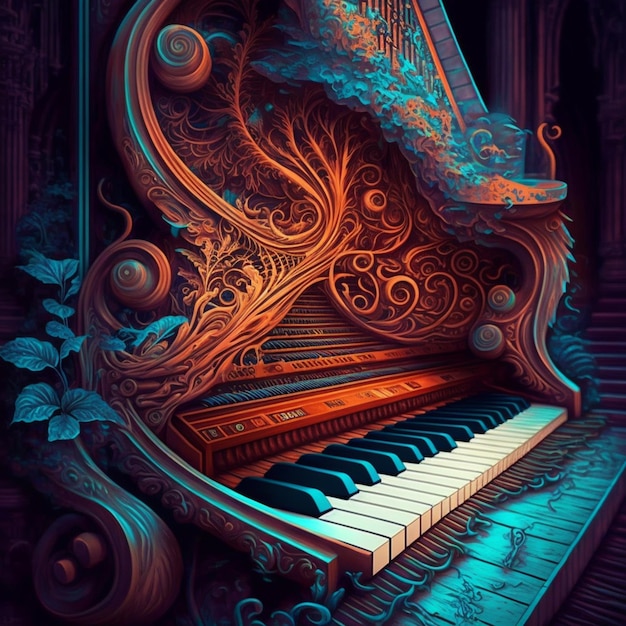
Find the location of `curved wood in the bottom left of the image`. curved wood in the bottom left of the image is located at coordinates (121, 603).